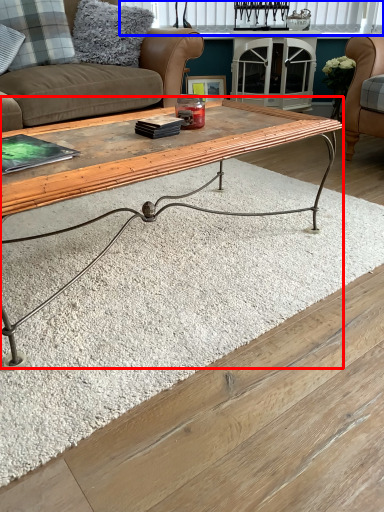
Question: Which point is further to the camera, coffee table (highlighted by a red box) or window (highlighted by a blue box)?

Choices:
 (A) coffee table
 (B) window

Answer: (B)